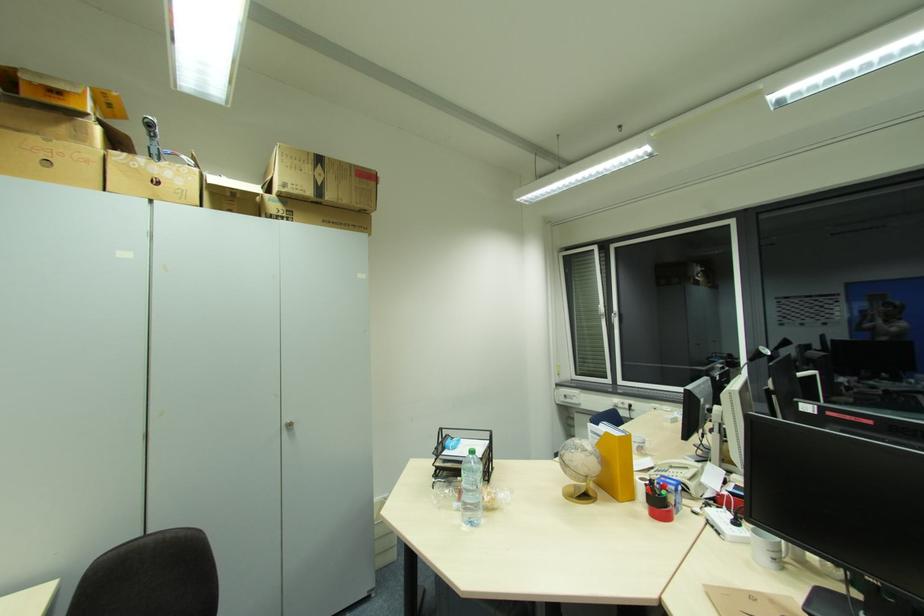
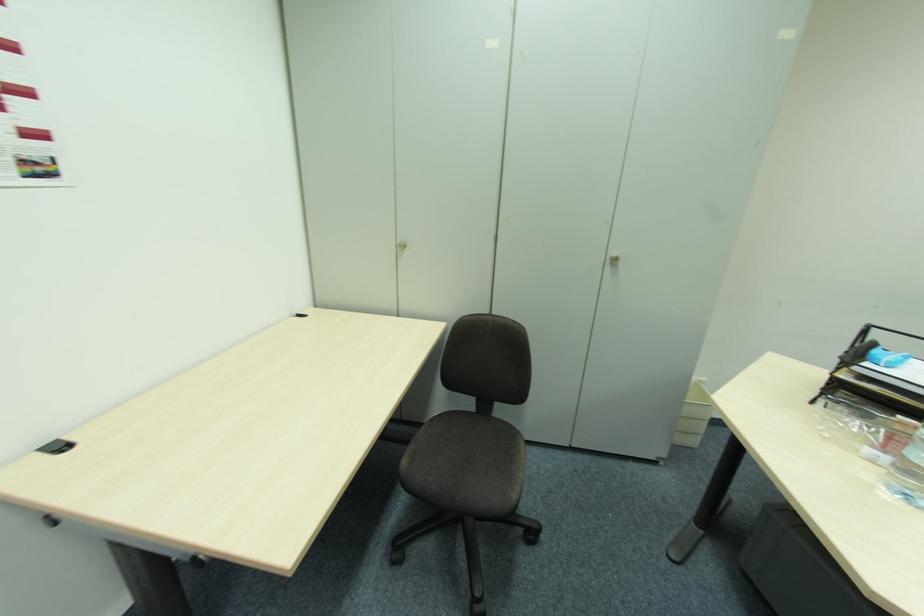
Based on the continuous images, in which direction is the camera rotating?

The rotation direction of the camera is left-down.